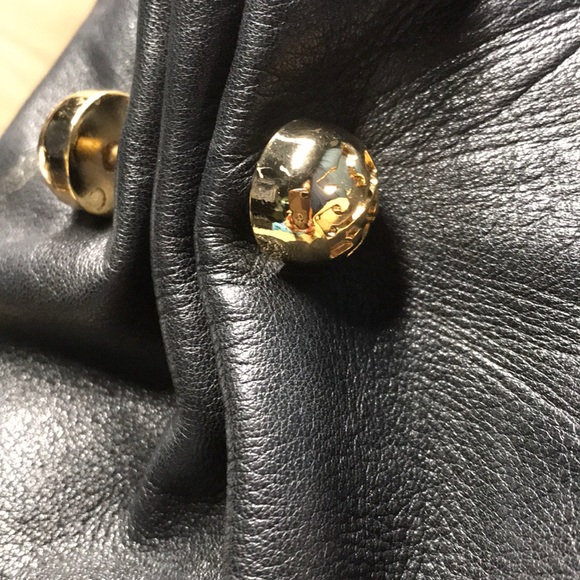
Locate an element on the screen. light area table is located at coordinates (37, 26).